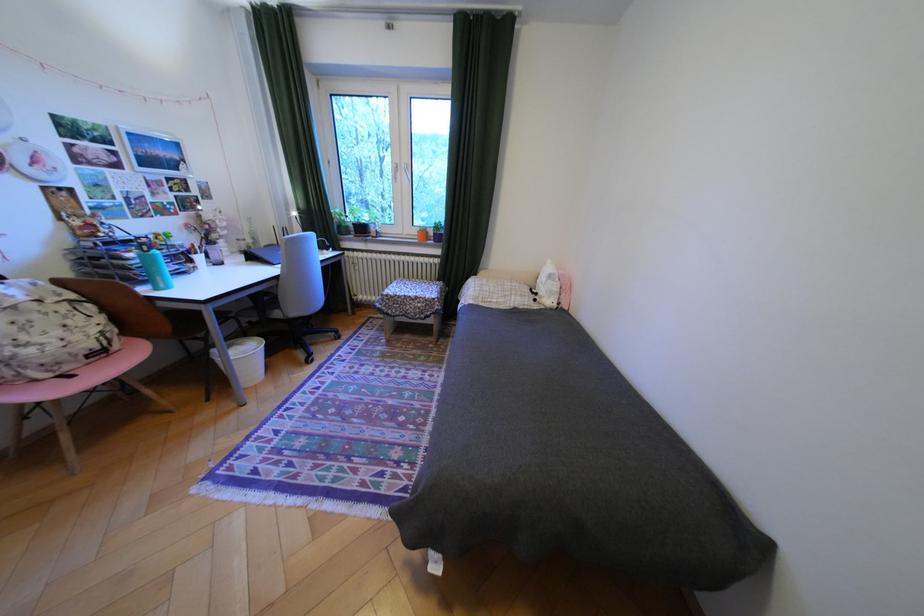
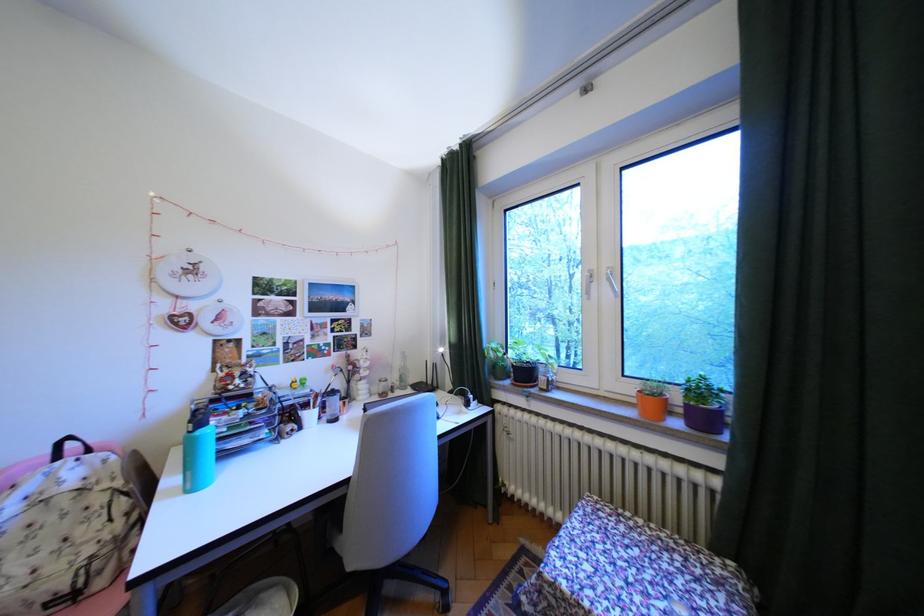
Find the pixel in the second image that matches [427,232] in the first image.

(641, 390)